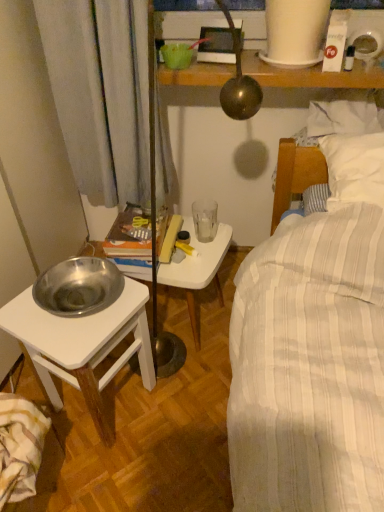
Question: Should I look upward or downward to see silver metallic bowl at left?

Choices:
 (A) down
 (B) up

Answer: (A)

Question: Does striped cotton blanket at lower left have a lesser height compared to silver metallic bowl at left?

Choices:
 (A) yes
 (B) no

Answer: (A)

Question: Is striped cotton blanket at lower left turned away from silver metallic bowl at left?

Choices:
 (A) no
 (B) yes

Answer: (A)

Question: Can you confirm if striped cotton blanket at lower left is bigger than silver metallic bowl at left?

Choices:
 (A) no
 (B) yes

Answer: (A)

Question: Does striped cotton blanket at lower left have a lesser width compared to silver metallic bowl at left?

Choices:
 (A) no
 (B) yes

Answer: (B)

Question: Can you confirm if striped cotton blanket at lower left is wider than silver metallic bowl at left?

Choices:
 (A) no
 (B) yes

Answer: (A)

Question: From the image's perspective, would you say striped cotton blanket at lower left is positioned over silver metallic bowl at left?

Choices:
 (A) no
 (B) yes

Answer: (A)

Question: Could you tell me if silver metallic bowl at left is turned towards white plastic table at center?

Choices:
 (A) yes
 (B) no

Answer: (B)

Question: From a real-world perspective, is silver metallic bowl at left located higher than white plastic table at center?

Choices:
 (A) yes
 (B) no

Answer: (A)

Question: Is silver metallic bowl at left smaller than white plastic table at center?

Choices:
 (A) no
 (B) yes

Answer: (A)

Question: Is silver metallic bowl at left bigger than white plastic table at center?

Choices:
 (A) no
 (B) yes

Answer: (B)

Question: Does silver metallic bowl at left have a greater height compared to white plastic table at center?

Choices:
 (A) yes
 (B) no

Answer: (A)

Question: From the image's perspective, does silver metallic bowl at left appear higher than white plastic table at center?

Choices:
 (A) yes
 (B) no

Answer: (B)

Question: From a real-world perspective, is white plastic table at center physically below striped cotton blanket at lower left?

Choices:
 (A) yes
 (B) no

Answer: (B)